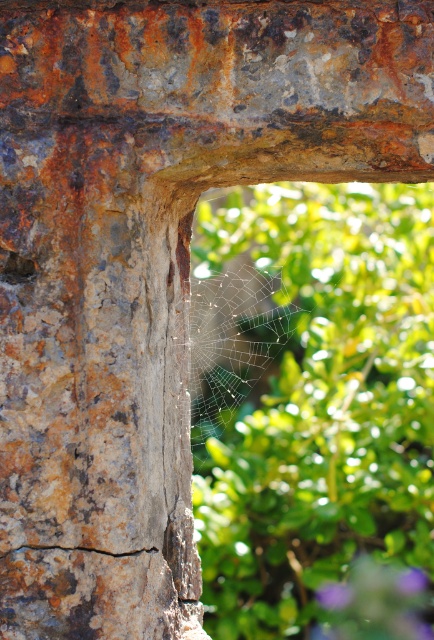
You are a maintenance worker inspecting the stone structure. You notice the transparent silk spider web at center and the rusty metal hole at left. Which object is closer to the ground?

The transparent silk spider web at center is positioned under the rusty metal hole at left, meaning it is closer to the ground than the rusty metal hole at left.

You are an architect examining the stone structure. You notice the rusty metal hole at left and the rusty metal crack at lower left. Which of these two features has a smaller width?

The rusty metal hole at left has a smaller width than the rusty metal crack at lower left.

You are an artist sketching this scene. You need to decide which object to draw first based on their sizes. Which one should you start with, the purple matte flower at lower right or the rusty metal crack at lower left?

The purple matte flower at lower right is wider than the rusty metal crack at lower left, so you should start with the purple matte flower at lower right since it is larger.